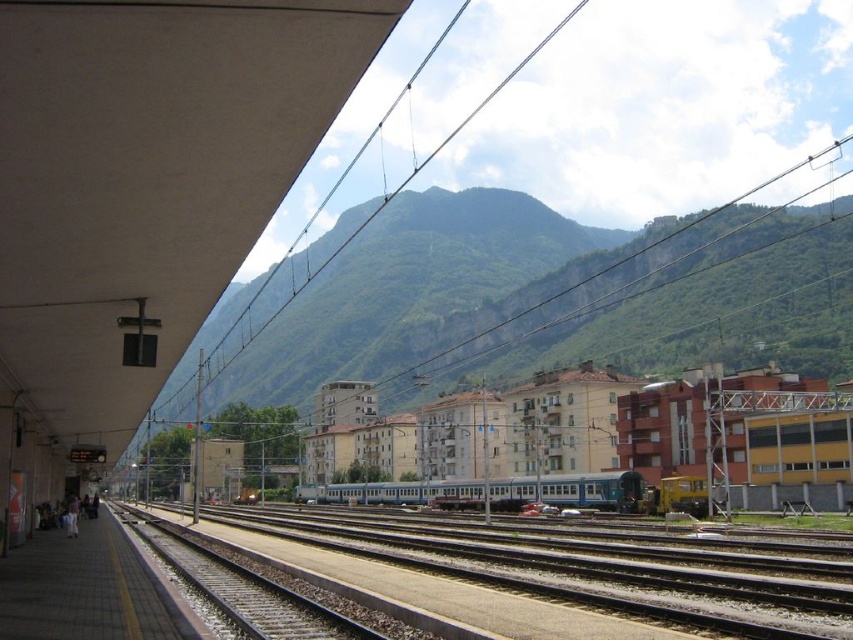
Can you confirm if metallic tracks at center is wider than silver metallic train at center?

No, metallic tracks at center is not wider than silver metallic train at center.

Can you confirm if metallic tracks at center is positioned below silver metallic train at center?

Actually, metallic tracks at center is above silver metallic train at center.

Identify the location of metallic tracks at center. Image resolution: width=853 pixels, height=640 pixels. (589, 573).